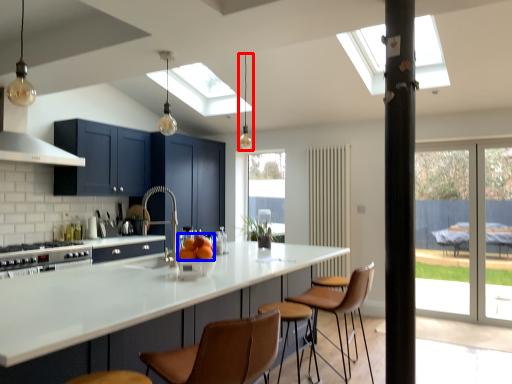
Question: Among these objects, which one is nearest to the camera, light fixture (highlighted by a red box) or orange (highlighted by a blue box)?

Choices:
 (A) light fixture
 (B) orange

Answer: (B)